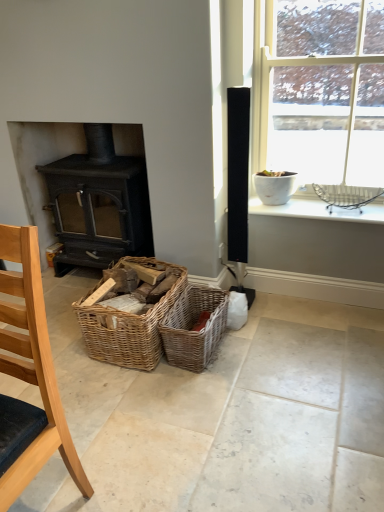
Image resolution: width=384 pixels, height=512 pixels. What are the coordinates of `vacant area on top of white ceramic bowl at upper right (from a real-world perspective)` in the screenshot? It's located at (318, 207).